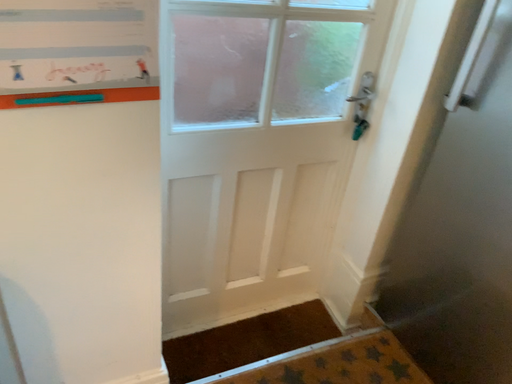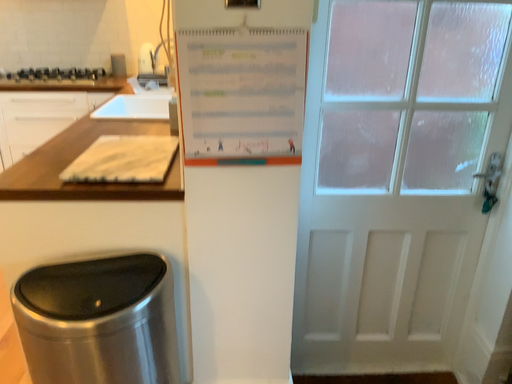
Question: How did the camera likely rotate when shooting the video?

Choices:
 (A) rotated left
 (B) rotated right

Answer: (A)